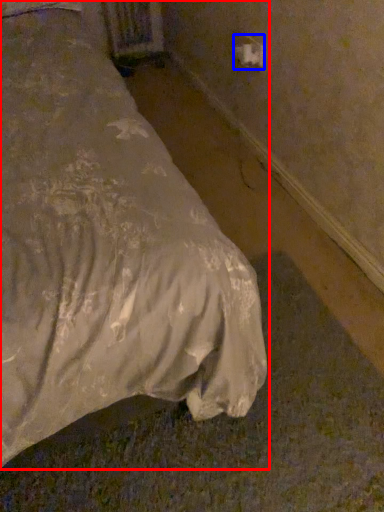
Question: Which object appears closest to the camera in this image, bed (highlighted by a red box) or electric outlet (highlighted by a blue box)?

Choices:
 (A) bed
 (B) electric outlet

Answer: (A)